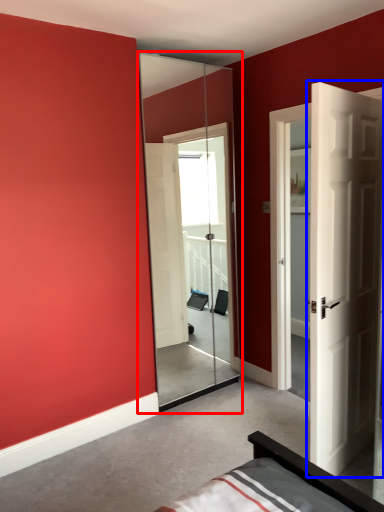
Question: Which object appears closest to the camera in this image, screen door (highlighted by a red box) or door (highlighted by a blue box)?

Choices:
 (A) screen door
 (B) door

Answer: (B)